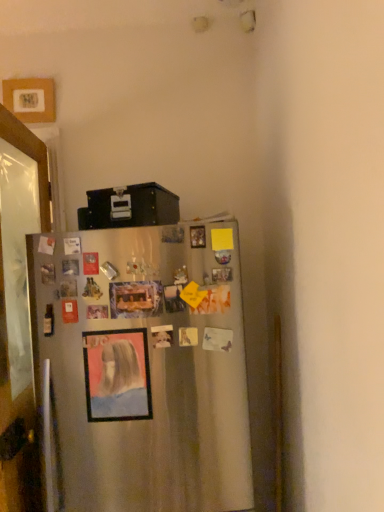
Question: Is clear glass door at left with matte plastic picture frame at center, arranged as the 2th picture frame when viewed from the back?

Choices:
 (A) yes
 (B) no

Answer: (B)

Question: Is clear glass door at left facing away from matte plastic picture frame at center, marked as the second picture frame in a left-to-right arrangement?

Choices:
 (A) yes
 (B) no

Answer: (B)

Question: Considering the relative sizes of clear glass door at left and matte plastic picture frame at center, which ranks as the second picture frame in top-to-bottom order, in the image provided, is clear glass door at left wider than matte plastic picture frame at center, which ranks as the second picture frame in top-to-bottom order,?

Choices:
 (A) yes
 (B) no

Answer: (A)

Question: Can you confirm if clear glass door at left is shorter than matte plastic picture frame at center, positioned as the 1th picture frame in front-to-back order?

Choices:
 (A) yes
 (B) no

Answer: (B)

Question: From the image's perspective, does clear glass door at left appear lower than matte plastic picture frame at center, the 1th picture frame positioned from the bottom?

Choices:
 (A) yes
 (B) no

Answer: (A)

Question: From a real-world perspective, is matte plastic picture frame at center, positioned as the 1th picture frame in front-to-back order, above or below wooden picture frame at upper left, marked as the 1th picture frame in a left-to-right arrangement?

Choices:
 (A) below
 (B) above

Answer: (A)

Question: Considering the positions of matte plastic picture frame at center, positioned as the 1th picture frame in front-to-back order, and wooden picture frame at upper left, marked as the first picture frame in a top-to-bottom arrangement, in the image, is matte plastic picture frame at center, positioned as the 1th picture frame in front-to-back order, taller or shorter than wooden picture frame at upper left, marked as the first picture frame in a top-to-bottom arrangement,?

Choices:
 (A) short
 (B) tall

Answer: (B)

Question: In terms of width, does matte plastic picture frame at center, which ranks as the second picture frame in top-to-bottom order, look wider or thinner when compared to wooden picture frame at upper left, the second picture frame positioned from the right?

Choices:
 (A) thin
 (B) wide

Answer: (A)

Question: Considering the positions of point (97, 356) and point (24, 101), is point (97, 356) closer or farther from the camera than point (24, 101)?

Choices:
 (A) closer
 (B) farther

Answer: (A)

Question: Is satin silver fridge at center inside or outside of wooden picture frame at upper left, marked as the 1th picture frame in a left-to-right arrangement?

Choices:
 (A) outside
 (B) inside

Answer: (A)

Question: Considering the positions of satin silver fridge at center and wooden picture frame at upper left, the second picture frame positioned from the right, in the image, is satin silver fridge at center wider or thinner than wooden picture frame at upper left, the second picture frame positioned from the right,?

Choices:
 (A) thin
 (B) wide

Answer: (A)

Question: Is point (64, 496) positioned closer to the camera than point (38, 105)?

Choices:
 (A) farther
 (B) closer

Answer: (B)

Question: In the image, is satin silver fridge at center on the left side or the right side of wooden picture frame at upper left, the second picture frame in the bottom-to-top sequence?

Choices:
 (A) left
 (B) right

Answer: (B)

Question: Do you think matte plastic picture frame at center, marked as the second picture frame in a left-to-right arrangement, is within satin silver fridge at center, or outside of it?

Choices:
 (A) outside
 (B) inside

Answer: (B)

Question: Is point (94, 416) positioned closer to the camera than point (99, 292)?

Choices:
 (A) farther
 (B) closer

Answer: (A)